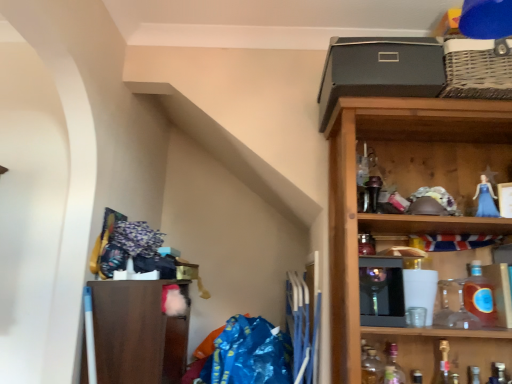
This screenshot has width=512, height=384. Describe the element at coordinates (445, 366) in the screenshot. I see `gold metallic bottle at lower right, the third bottle positioned from the right` at that location.

Identify the location of translucent amber glass bottle at right, the 4th bottle from the left. (479, 296).

How much space does translucent glass bottle at lower right, the second bottle viewed from the left, occupy horizontally?

translucent glass bottle at lower right, the second bottle viewed from the left, is 2.68 inches wide.

Image resolution: width=512 pixels, height=384 pixels. What are the coordinates of `gold metallic bottle at lower right, the 3th bottle in the left-to-right sequence` in the screenshot? It's located at (445, 366).

Is gold metallic bottle at lower right, the 3th bottle in the left-to-right sequence, a part of brown matte cabinet at lower left, positioned as the second shelf in right-to-left order?

No.

Considering the relative sizes of brown matte cabinet at lower left, positioned as the second shelf in right-to-left order, and gold metallic bottle at lower right, the third bottle positioned from the right, in the image provided, is brown matte cabinet at lower left, positioned as the second shelf in right-to-left order, shorter than gold metallic bottle at lower right, the third bottle positioned from the right,?

Incorrect, the height of brown matte cabinet at lower left, positioned as the second shelf in right-to-left order, does not fall short of that of gold metallic bottle at lower right, the third bottle positioned from the right.

Can you confirm if brown matte cabinet at lower left, the 1th shelf viewed from the left, is positioned to the right of gold metallic bottle at lower right, the third bottle positioned from the right?

No, brown matte cabinet at lower left, the 1th shelf viewed from the left, is not to the right of gold metallic bottle at lower right, the third bottle positioned from the right.

Looking at this image, is brown matte cabinet at lower left, the 1th shelf viewed from the left, in front of or behind gold metallic bottle at lower right, the third bottle positioned from the right, in the image?

brown matte cabinet at lower left, the 1th shelf viewed from the left, is positioned farther from the viewer than gold metallic bottle at lower right, the third bottle positioned from the right.

From the image's perspective, is translucent amber glass bottle at right, the 4th bottle from the left, above or below translucent glass bottle at lower right, the second bottle viewed from the left?

Clearly, from the image's perspective, translucent amber glass bottle at right, the 4th bottle from the left, is above translucent glass bottle at lower right, the second bottle viewed from the left.

Which of these two, translucent amber glass bottle at right, positioned as the 2th bottle in right-to-left order, or translucent glass bottle at lower right, arranged as the fourth bottle when viewed from the right, is wider?

Wider between the two is translucent amber glass bottle at right, positioned as the 2th bottle in right-to-left order.

Considering the relative positions of translucent amber glass bottle at right, positioned as the 2th bottle in right-to-left order, and translucent glass bottle at lower right, arranged as the fourth bottle when viewed from the right, in the image provided, is translucent amber glass bottle at right, positioned as the 2th bottle in right-to-left order, to the left or to the right of translucent glass bottle at lower right, arranged as the fourth bottle when viewed from the right,?

Based on their positions, translucent amber glass bottle at right, positioned as the 2th bottle in right-to-left order, is located to the right of translucent glass bottle at lower right, arranged as the fourth bottle when viewed from the right.

From a real-world perspective, which object rests below the other?

From a 3D spatial view, translucent glass bottle at lower right, the second bottle viewed from the left, is below.

Between translucent glass bottle at lower right, which is counted as the fifth bottle, starting from the right, and translucent amber glass bottle at right, positioned as the 2th bottle in right-to-left order, which one appears on the left side from the viewer's perspective?

From the viewer's perspective, translucent glass bottle at lower right, which is counted as the fifth bottle, starting from the right, appears more on the left side.

Can you confirm if translucent glass bottle at lower right, which appears as the 1th bottle when viewed from the left, is taller than translucent amber glass bottle at right, positioned as the 2th bottle in right-to-left order?

Yes.

How distant is translucent glass bottle at lower right, which is counted as the fifth bottle, starting from the right, from translucent amber glass bottle at right, the 4th bottle from the left?

16.51 inches.

Which point is more distant from viewer, (370, 378) or (485, 318)?

The point (485, 318) is farther from the camera.

Consider the image. Measure the distance from translucent glass bottle at lower right, which appears as the 1th bottle when viewed from the left, to brown matte cabinet at lower left, positioned as the second shelf in right-to-left order.

translucent glass bottle at lower right, which appears as the 1th bottle when viewed from the left, is 82.12 centimeters away from brown matte cabinet at lower left, positioned as the second shelf in right-to-left order.

Consider the image. Which of these two, translucent glass bottle at lower right, which is counted as the fifth bottle, starting from the right, or brown matte cabinet at lower left, positioned as the second shelf in right-to-left order, is smaller?

translucent glass bottle at lower right, which is counted as the fifth bottle, starting from the right, is smaller.

From the image's perspective, which is above, translucent glass bottle at lower right, which appears as the 1th bottle when viewed from the left, or brown matte cabinet at lower left, the 1th shelf viewed from the left?

From the image's view, brown matte cabinet at lower left, the 1th shelf viewed from the left, is above.

Which is more to the left, translucent glass bottle at lower right, which appears as the 1th bottle when viewed from the left, or brown matte cabinet at lower left, the 1th shelf viewed from the left?

brown matte cabinet at lower left, the 1th shelf viewed from the left, is more to the left.

Considering the relative sizes of matte gray box at upper right and brown matte cabinet at lower left, the 1th shelf viewed from the left, in the image provided, is matte gray box at upper right thinner than brown matte cabinet at lower left, the 1th shelf viewed from the left,?

In fact, matte gray box at upper right might be wider than brown matte cabinet at lower left, the 1th shelf viewed from the left.

Is matte gray box at upper right oriented towards brown matte cabinet at lower left, positioned as the second shelf in right-to-left order?

No, matte gray box at upper right is not aimed at brown matte cabinet at lower left, positioned as the second shelf in right-to-left order.

From the image's perspective, is matte gray box at upper right located beneath brown matte cabinet at lower left, the 1th shelf viewed from the left?

No, from the image's perspective, matte gray box at upper right is not below brown matte cabinet at lower left, the 1th shelf viewed from the left.

Does blue plastic bag at lower center have a smaller size compared to matte gray box at upper right?

Incorrect, blue plastic bag at lower center is not smaller in size than matte gray box at upper right.

Is blue plastic bag at lower center in contact with matte gray box at upper right?

No, blue plastic bag at lower center is not with matte gray box at upper right.

In the image, is blue plastic bag at lower center positioned in front of or behind matte gray box at upper right?

Clearly, blue plastic bag at lower center is behind matte gray box at upper right.

Which object is further away from the camera taking this photo, matte gray box at upper right or metallic silver bottle at lower right, the 1th bottle viewed from the right?

Positioned behind is metallic silver bottle at lower right, the 1th bottle viewed from the right.

Can you confirm if matte gray box at upper right is shorter than metallic silver bottle at lower right, placed as the fifth bottle when sorted from left to right?

Yes.

Is matte gray box at upper right placed right next to metallic silver bottle at lower right, the 1th bottle viewed from the right?

There is a gap between matte gray box at upper right and metallic silver bottle at lower right, the 1th bottle viewed from the right.

I want to click on the 1st bottle positioned below the brown matte cabinet at lower left, the 1th shelf viewed from the left (from the image's perspective), so click(x=445, y=366).

The image size is (512, 384). In order to click on bottle behind the translucent glass bottle at lower right, the second bottle viewed from the left in this screenshot , I will do `click(479, 296)`.

From the image, which object appears to be nearer to matte gray box at upper right, translucent glass bottle at lower right, which is counted as the fifth bottle, starting from the right, or wooden shelf at upper right, which ranks as the second shelf in left-to-right order?

wooden shelf at upper right, which ranks as the second shelf in left-to-right order.

Estimate the real-world distances between objects in this image. Which object is closer to blue plastic bag at lower center, wooden shelf at upper right, which ranks as the second shelf in left-to-right order, or gold metallic bottle at lower right, the third bottle positioned from the right?

wooden shelf at upper right, which ranks as the second shelf in left-to-right order, lies closer to blue plastic bag at lower center than the other object.

From the image, which object appears to be farther from gold metallic bottle at lower right, the third bottle positioned from the right, wooden shelf at upper right, which ranks as the second shelf in left-to-right order, or translucent amber glass bottle at right, positioned as the 2th bottle in right-to-left order?

wooden shelf at upper right, which ranks as the second shelf in left-to-right order, lies further to gold metallic bottle at lower right, the third bottle positioned from the right, than the other object.

Which object lies further to the anchor point metallic silver bottle at lower right, the 1th bottle viewed from the right, translucent glass bottle at lower right, the second bottle viewed from the left, or wooden shelf at upper right, which is the 1th shelf from right to left?

wooden shelf at upper right, which is the 1th shelf from right to left.

Based on their spatial positions, is blue plastic bag at lower center or translucent amber glass bottle at right, positioned as the 2th bottle in right-to-left order, closer to brown matte cabinet at lower left, positioned as the second shelf in right-to-left order?

Among the two, blue plastic bag at lower center is located nearer to brown matte cabinet at lower left, positioned as the second shelf in right-to-left order.

Based on their spatial positions, is translucent amber glass bottle at right, positioned as the 2th bottle in right-to-left order, or wooden shelf at upper right, which is the 1th shelf from right to left, closer to gold metallic bottle at lower right, the 3th bottle in the left-to-right sequence?

translucent amber glass bottle at right, positioned as the 2th bottle in right-to-left order.

Consider the image. Estimate the real-world distances between objects in this image. Which object is closer to metallic silver bottle at lower right, placed as the fifth bottle when sorted from left to right, wooden shelf at upper right, which is the 1th shelf from right to left, or translucent amber glass bottle at right, the 4th bottle from the left?

translucent amber glass bottle at right, the 4th bottle from the left, is positioned closer to the anchor metallic silver bottle at lower right, placed as the fifth bottle when sorted from left to right.

Based on their spatial positions, is translucent glass bottle at lower right, which appears as the 1th bottle when viewed from the left, or translucent glass bottle at lower right, arranged as the fourth bottle when viewed from the right, further from brown matte cabinet at lower left, the 1th shelf viewed from the left?

translucent glass bottle at lower right, arranged as the fourth bottle when viewed from the right, lies further to brown matte cabinet at lower left, the 1th shelf viewed from the left, than the other object.

Where is `material between matte gray box at upper right and metallic silver bottle at lower right, the 1th bottle viewed from the right, in the up-down direction`? This screenshot has height=384, width=512. material between matte gray box at upper right and metallic silver bottle at lower right, the 1th bottle viewed from the right, in the up-down direction is located at coordinates (246, 355).

Locate an element on the screen. Image resolution: width=512 pixels, height=384 pixels. material located between brown matte cabinet at lower left, the 1th shelf viewed from the left, and translucent amber glass bottle at right, positioned as the 2th bottle in right-to-left order, in the left-right direction is located at coordinates (246, 355).

The image size is (512, 384). Find the location of `box between brown matte cabinet at lower left, the 1th shelf viewed from the left, and wooden shelf at upper right, which ranks as the second shelf in left-to-right order, in the horizontal direction`. box between brown matte cabinet at lower left, the 1th shelf viewed from the left, and wooden shelf at upper right, which ranks as the second shelf in left-to-right order, in the horizontal direction is located at coordinates (380, 70).

The image size is (512, 384). Find the location of `bottle between matte gray box at upper right and gold metallic bottle at lower right, the 3th bottle in the left-to-right sequence, in the vertical direction`. bottle between matte gray box at upper right and gold metallic bottle at lower right, the 3th bottle in the left-to-right sequence, in the vertical direction is located at coordinates (479, 296).